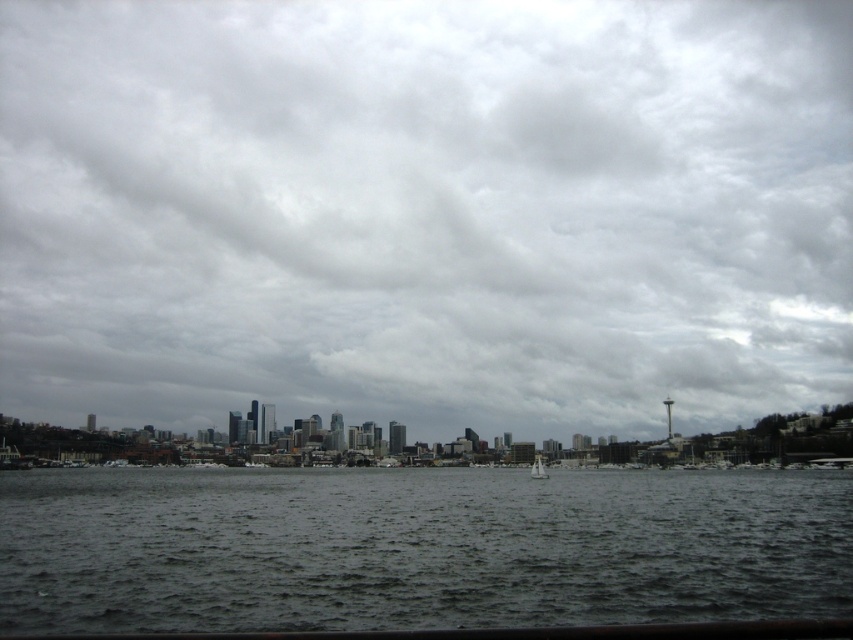
Question: Estimate the real-world distances between objects in this image. Which object is farther from the cloudy sky at center?

Choices:
 (A) dark gray water at center
 (B) white plastic sailboat at center

Answer: (A)

Question: Considering the relative positions of dark gray water at center and white plastic sailboat at center in the image provided, where is dark gray water at center located with respect to white plastic sailboat at center?

Choices:
 (A) right
 (B) left

Answer: (B)

Question: Considering the real-world distances, which object is closest to the white plastic sailboat at center?

Choices:
 (A) cloudy sky at center
 (B) dark gray water at center

Answer: (B)

Question: Which object is closer to the camera taking this photo?

Choices:
 (A) white plastic sailboat at center
 (B) dark gray water at center
 (C) cloudy sky at center

Answer: (B)

Question: Does cloudy sky at center appear under dark gray water at center?

Choices:
 (A) no
 (B) yes

Answer: (A)

Question: Can you confirm if cloudy sky at center is positioned to the left of white plastic sailboat at center?

Choices:
 (A) no
 (B) yes

Answer: (B)